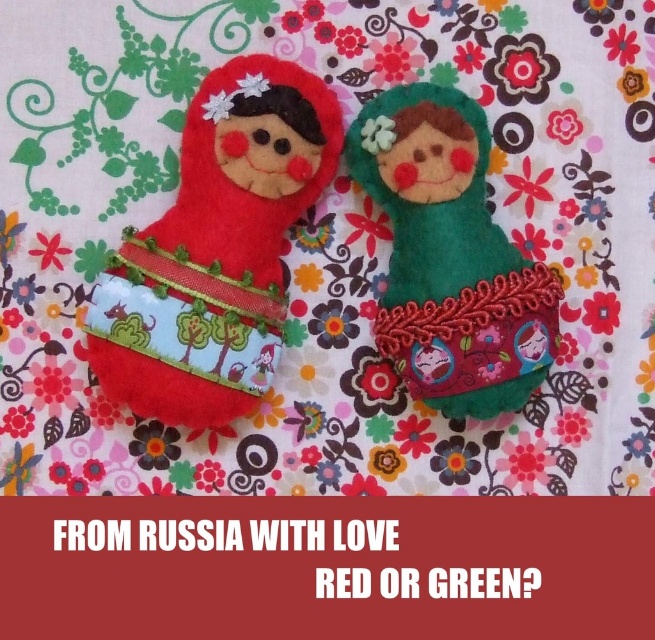
Between matte felt doll at left and green felt doll at center, which one is positioned higher?

matte felt doll at left is above.

Can you confirm if matte felt doll at left is positioned to the right of green felt doll at center?

Incorrect, matte felt doll at left is not on the right side of green felt doll at center.

Is point (215, 104) more distant than point (434, 273)?

No, it is not.

The width and height of the screenshot is (655, 640). I want to click on matte felt doll at left, so click(x=215, y=250).